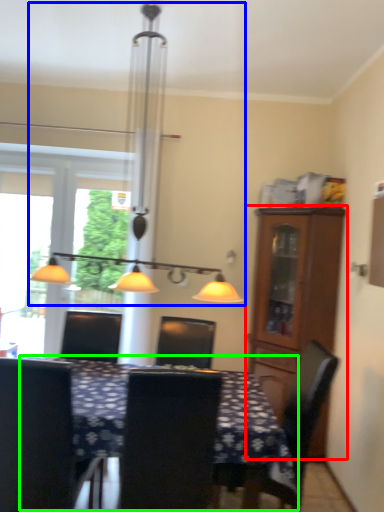
Question: Considering the real-world distances, which object is closest to cabinetry (highlighted by a red box)? table lamp (highlighted by a blue box) or table (highlighted by a green box).

Choices:
 (A) table lamp
 (B) table

Answer: (A)